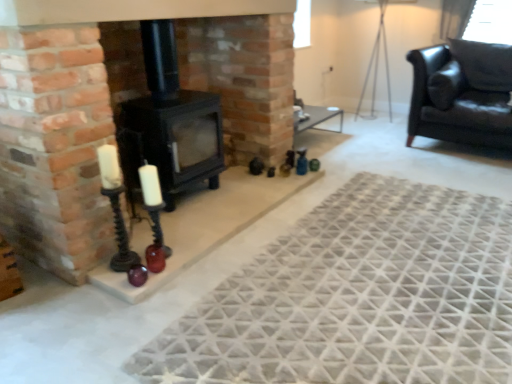
Locate an element on the screen. The height and width of the screenshot is (384, 512). vacant space to the right of black matte wood burning stove at center is located at coordinates (238, 196).